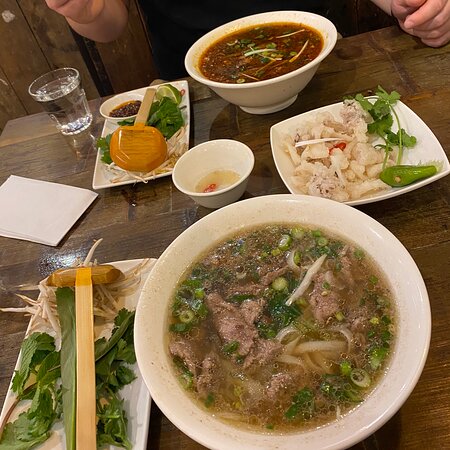
Where is `bowl`? Image resolution: width=450 pixels, height=450 pixels. bowl is located at coordinates (397, 387).